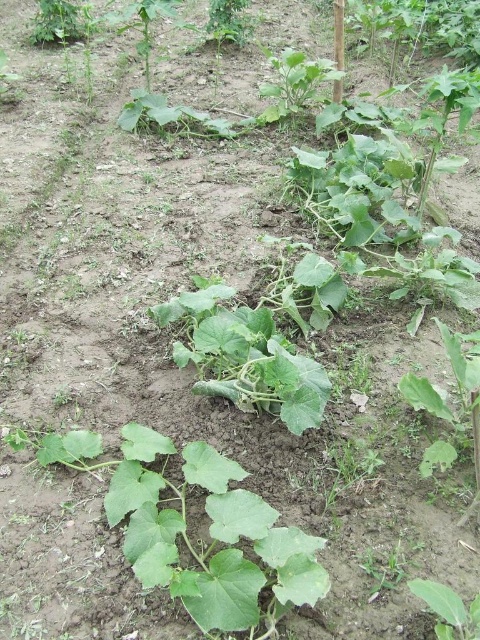
Is green matte leafy plant at center smaller than green leafy plant at upper center?

Yes.

Can you confirm if green matte leafy plant at center is taller than green leafy plant at upper center?

No.

Is point (153, 586) in front of point (288, 72)?

Yes.

The height and width of the screenshot is (640, 480). Find the location of `green matte leafy plant at center`. green matte leafy plant at center is located at coordinates (187, 529).

Is green leafy plant at upper center wider than green leafy plant at lower right?

Yes.

Which is in front, point (287, 56) or point (435, 586)?

Positioned in front is point (435, 586).

At what (x,y) coordinates should I click in order to perform the action: click on green leafy plant at upper center. Please return your answer as a coordinate pair (x, y). The height and width of the screenshot is (640, 480). Looking at the image, I should click on (294, 84).

Between green leafy plant at upper center and green leafy plant at lower center, which one appears on the left side from the viewer's perspective?

Positioned to the left is green leafy plant at upper center.

Which of these two, green leafy plant at upper center or green leafy plant at lower center, stands taller?

With more height is green leafy plant at upper center.

Which is behind, point (276, 68) or point (400, 545)?

Point (276, 68)

Where is `green leafy plant at upper center`? The image size is (480, 640). green leafy plant at upper center is located at coordinates (294, 84).